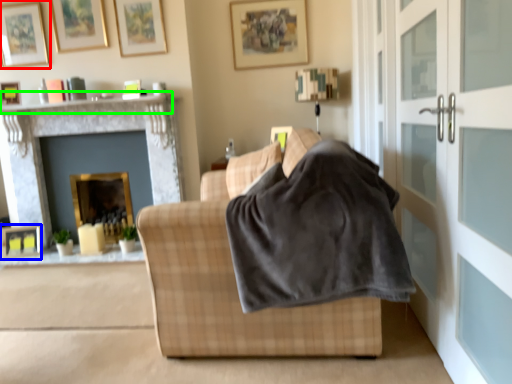
Question: Which is farther away from picture frame (highlighted by a red box)? picture frame (highlighted by a blue box) or mantle (highlighted by a green box)?

Choices:
 (A) picture frame
 (B) mantle

Answer: (A)